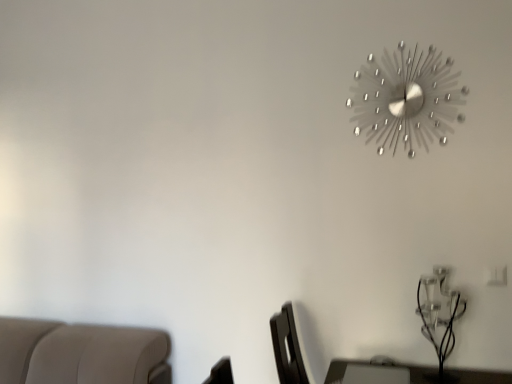
Question: Can you confirm if metallic silver clock at upper right is shorter than clear glass table lamp at lower right?

Choices:
 (A) no
 (B) yes

Answer: (A)

Question: Is metallic silver clock at upper right facing away from clear glass table lamp at lower right?

Choices:
 (A) yes
 (B) no

Answer: (B)

Question: Is metallic silver clock at upper right to the right of clear glass table lamp at lower right from the viewer's perspective?

Choices:
 (A) yes
 (B) no

Answer: (B)

Question: From the image's perspective, does metallic silver clock at upper right appear lower than clear glass table lamp at lower right?

Choices:
 (A) no
 (B) yes

Answer: (A)

Question: Considering the relative sizes of metallic silver clock at upper right and clear glass table lamp at lower right in the image provided, is metallic silver clock at upper right thinner than clear glass table lamp at lower right?

Choices:
 (A) yes
 (B) no

Answer: (A)

Question: Is metallic silver clock at upper right behind clear glass table lamp at lower right?

Choices:
 (A) yes
 (B) no

Answer: (A)

Question: Is clear glass table lamp at lower right positioned beyond the bounds of metallic silver clock at upper right?

Choices:
 (A) yes
 (B) no

Answer: (A)

Question: Does clear glass table lamp at lower right appear on the right side of metallic silver clock at upper right?

Choices:
 (A) yes
 (B) no

Answer: (A)

Question: Can you see clear glass table lamp at lower right touching metallic silver clock at upper right?

Choices:
 (A) yes
 (B) no

Answer: (B)

Question: Is the position of clear glass table lamp at lower right less distant than that of metallic silver clock at upper right?

Choices:
 (A) no
 (B) yes

Answer: (B)

Question: Does clear glass table lamp at lower right have a lesser height compared to metallic silver clock at upper right?

Choices:
 (A) yes
 (B) no

Answer: (A)

Question: Can metallic silver clock at upper right be found inside clear glass table lamp at lower right?

Choices:
 (A) no
 (B) yes

Answer: (A)

Question: From the image's perspective, is clear glass table lamp at lower right positioned above or below metallic silver clock at upper right?

Choices:
 (A) below
 (B) above

Answer: (A)